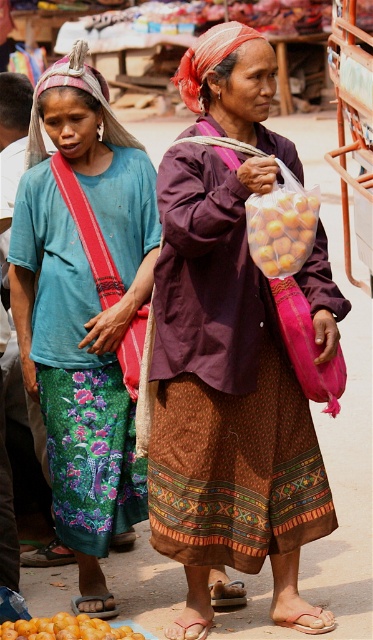
You are a fashion designer observing the market scene. You need to decide which item would require more fabric for a custom order between the matte purple blouse at center and the yellow matte dried fruit at center. Which one would need more fabric?

The matte purple blouse at center would require more fabric than the yellow matte dried fruit at center because the blouse is wider according to the description.

You are a vendor at the market and need to arrange fruits based on their sizes. If you have the yellow matte dried fruit at center and the orange matte fruit at lower left, which fruit should you place in the smaller section of your stall?

The yellow matte dried fruit at center should be placed in the smaller section because its width is less than the orange matte fruit at lower left.